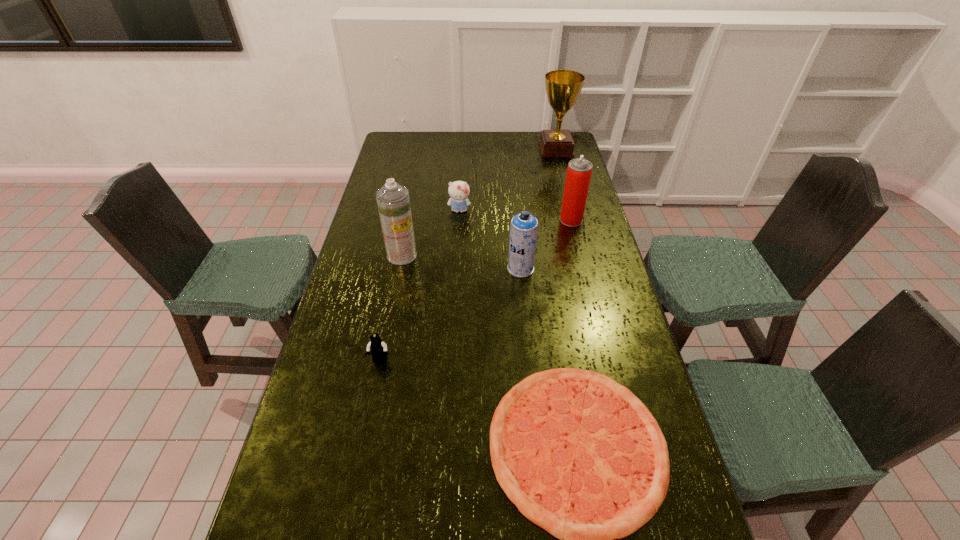
This screenshot has width=960, height=540. Identify the location of award that is at the right edge. (563, 87).

The width and height of the screenshot is (960, 540). Identify the location of aerosol can located in the right edge section of the desktop. (579, 170).

Identify the location of object that is at the far right corner. This screenshot has width=960, height=540. (563, 87).

I want to click on free space at the far edge of the desktop, so click(469, 154).

Identify the location of blank space at the left edge of the desktop. Image resolution: width=960 pixels, height=540 pixels. (319, 369).

I want to click on vacant space at the right edge of the desktop, so click(556, 187).

I want to click on vacant position at the far left corner of the desktop, so pos(403,134).

What are the coordinates of `vacant space that's between the rightmost aerosol can and the sixth farthest object` in the screenshot? It's located at (475, 289).

You are a GUI agent. You are given a task and a screenshot of the screen. Output one action in this format:
    pyautogui.click(x=<x>, y=<y>)
    Task: Click on the free space between the fourth shortest object and the farthest object
    This screenshot has height=540, width=960.
    Given the screenshot: What is the action you would take?
    pyautogui.click(x=539, y=209)

What are the coordinates of `vacant area that lies between the leftmost aerosol can and the shortest aerosol can` in the screenshot? It's located at (462, 262).